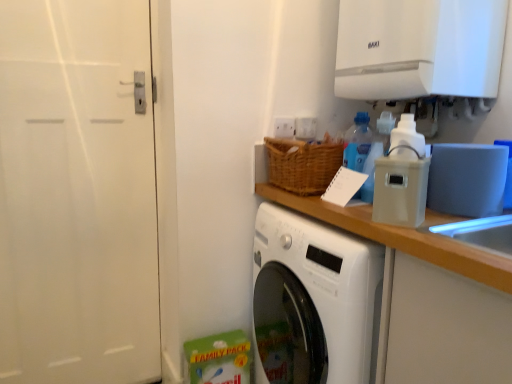
Describe the element at coordinates (400, 188) in the screenshot. The height and width of the screenshot is (384, 512). I see `white plastic container at upper right` at that location.

The height and width of the screenshot is (384, 512). I want to click on translucent plastic soap dispenser at upper right, the 2th bottle positioned from the left, so click(376, 153).

This screenshot has height=384, width=512. Identify the location of white matte door at left. (77, 194).

Locate an element on the screen. white glossy exhaust hood at upper right is located at coordinates (419, 48).

Measure the distance between white glossy exhaust hood at upper right and camera.

white glossy exhaust hood at upper right and camera are 1.20 meters apart from each other.

The width and height of the screenshot is (512, 384). In order to click on white plastic container at upper right in this screenshot , I will do `click(400, 188)`.

From the image's perspective, which one is positioned lower, white matte door at left or white plastic container at upper right?

white matte door at left, from the image's perspective.

From a real-world perspective, is white matte door at left positioned over white plastic container at upper right based on gravity?

No, from a real-world perspective, white matte door at left is not on top of white plastic container at upper right.

Considering the positions of objects white matte door at left and white plastic container at upper right in the image provided, who is more to the right, white matte door at left or white plastic container at upper right?

Positioned to the right is white plastic container at upper right.

I want to click on appliance that is on the right side of white matte door at left, so click(x=400, y=188).

Is blue translucent bottle at upper right, which appears as the 2th bottle when viewed from the right, at the back of translucent plastic soap dispenser at upper right, the 2th bottle positioned from the left?

Yes, translucent plastic soap dispenser at upper right, the 2th bottle positioned from the left, is positioned with its back facing blue translucent bottle at upper right, which appears as the 2th bottle when viewed from the right.

Which is less distant, [372,170] or [344,154]?

Point [372,170] is closer to the camera than point [344,154].

From a real-world perspective, is translucent plastic soap dispenser at upper right, placed as the 1th bottle when sorted from right to left, below blue translucent bottle at upper right, marked as the first bottle in a left-to-right arrangement?

Indeed, from a real-world perspective, translucent plastic soap dispenser at upper right, placed as the 1th bottle when sorted from right to left, is positioned beneath blue translucent bottle at upper right, marked as the first bottle in a left-to-right arrangement.

Considering the sizes of objects translucent plastic soap dispenser at upper right, the 2th bottle positioned from the left, and blue translucent bottle at upper right, marked as the first bottle in a left-to-right arrangement, in the image provided, who is shorter, translucent plastic soap dispenser at upper right, the 2th bottle positioned from the left, or blue translucent bottle at upper right, marked as the first bottle in a left-to-right arrangement,?

translucent plastic soap dispenser at upper right, the 2th bottle positioned from the left, is shorter.

Considering the positions of objects blue translucent bottle at upper right, marked as the first bottle in a left-to-right arrangement, and white glossy exhaust hood at upper right in the image provided, who is more to the left, blue translucent bottle at upper right, marked as the first bottle in a left-to-right arrangement, or white glossy exhaust hood at upper right?

blue translucent bottle at upper right, marked as the first bottle in a left-to-right arrangement, is more to the left.

Is blue translucent bottle at upper right, which appears as the 2th bottle when viewed from the right, oriented away from white glossy exhaust hood at upper right?

No, white glossy exhaust hood at upper right is not at the back of blue translucent bottle at upper right, which appears as the 2th bottle when viewed from the right.

Considering the relative sizes of blue translucent bottle at upper right, which appears as the 2th bottle when viewed from the right, and white glossy exhaust hood at upper right in the image provided, is blue translucent bottle at upper right, which appears as the 2th bottle when viewed from the right, smaller than white glossy exhaust hood at upper right?

Yes.

How much distance is there between blue translucent bottle at upper right, which appears as the 2th bottle when viewed from the right, and white glossy exhaust hood at upper right?

blue translucent bottle at upper right, which appears as the 2th bottle when viewed from the right, is 12.64 inches away from white glossy exhaust hood at upper right.

Is blue translucent bottle at upper right, which appears as the 2th bottle when viewed from the right, aimed at translucent plastic soap dispenser at upper right, placed as the 1th bottle when sorted from right to left?

Yes.

Would you say blue translucent bottle at upper right, marked as the first bottle in a left-to-right arrangement, is a long distance from translucent plastic soap dispenser at upper right, the 2th bottle positioned from the left?

No, there isn't a large distance between blue translucent bottle at upper right, marked as the first bottle in a left-to-right arrangement, and translucent plastic soap dispenser at upper right, the 2th bottle positioned from the left.

Which object is wider, blue translucent bottle at upper right, which appears as the 2th bottle when viewed from the right, or translucent plastic soap dispenser at upper right, placed as the 1th bottle when sorted from right to left?

With larger width is translucent plastic soap dispenser at upper right, placed as the 1th bottle when sorted from right to left.

Is blue translucent bottle at upper right, marked as the first bottle in a left-to-right arrangement, positioned behind translucent plastic soap dispenser at upper right, placed as the 1th bottle when sorted from right to left?

Yes.

How far apart are blue translucent bottle at upper right, marked as the first bottle in a left-to-right arrangement, and white plastic container at upper right?

The distance of blue translucent bottle at upper right, marked as the first bottle in a left-to-right arrangement, from white plastic container at upper right is 9.04 inches.

In the image, is blue translucent bottle at upper right, which appears as the 2th bottle when viewed from the right, on the left side or the right side of white plastic container at upper right?

From the image, it's evident that blue translucent bottle at upper right, which appears as the 2th bottle when viewed from the right, is to the left of white plastic container at upper right.

Does blue translucent bottle at upper right, marked as the first bottle in a left-to-right arrangement, have a lesser height compared to white plastic container at upper right?

No.

Would you consider blue translucent bottle at upper right, which appears as the 2th bottle when viewed from the right, to be distant from white plastic container at upper right?

That's not correct — blue translucent bottle at upper right, which appears as the 2th bottle when viewed from the right, is a little close to white plastic container at upper right.

Which is more distant, (407, 222) or (346, 148)?

The point (346, 148) is farther from the camera.

Identify the location of appliance that is on the right side of blue translucent bottle at upper right, marked as the first bottle in a left-to-right arrangement. Image resolution: width=512 pixels, height=384 pixels. (400, 188).

Considering the relative sizes of white plastic container at upper right and blue translucent bottle at upper right, marked as the first bottle in a left-to-right arrangement, in the image provided, is white plastic container at upper right thinner than blue translucent bottle at upper right, marked as the first bottle in a left-to-right arrangement,?

No, white plastic container at upper right is not thinner than blue translucent bottle at upper right, marked as the first bottle in a left-to-right arrangement.

Considering the sizes of objects white plastic container at upper right and blue translucent bottle at upper right, which appears as the 2th bottle when viewed from the right, in the image provided, who is shorter, white plastic container at upper right or blue translucent bottle at upper right, which appears as the 2th bottle when viewed from the right,?

Standing shorter between the two is white plastic container at upper right.

Consider the image. Is translucent plastic soap dispenser at upper right, the 2th bottle positioned from the left, closer to the viewer compared to white glossy exhaust hood at upper right?

No.

Measure the distance from translucent plastic soap dispenser at upper right, placed as the 1th bottle when sorted from right to left, to white glossy exhaust hood at upper right.

10.42 inches.

From the image's perspective, which is above, translucent plastic soap dispenser at upper right, placed as the 1th bottle when sorted from right to left, or white glossy exhaust hood at upper right?

white glossy exhaust hood at upper right, from the image's perspective.

Considering the relative sizes of translucent plastic soap dispenser at upper right, placed as the 1th bottle when sorted from right to left, and white glossy exhaust hood at upper right in the image provided, is translucent plastic soap dispenser at upper right, placed as the 1th bottle when sorted from right to left, wider than white glossy exhaust hood at upper right?

No.

Find the location of `appliance in front of the white matte door at left`. appliance in front of the white matte door at left is located at coordinates (400, 188).

Identify the location of bottle below the blue translucent bottle at upper right, which appears as the 2th bottle when viewed from the right (from the image's perspective). [x=376, y=153].

Which object lies nearer to the anchor point blue translucent bottle at upper right, which appears as the 2th bottle when viewed from the right, white matte door at left or white glossy exhaust hood at upper right?

Among the two, white glossy exhaust hood at upper right is located nearer to blue translucent bottle at upper right, which appears as the 2th bottle when viewed from the right.

Based on their spatial positions, is translucent plastic soap dispenser at upper right, the 2th bottle positioned from the left, or white glossy exhaust hood at upper right closer to white matte door at left?

white glossy exhaust hood at upper right lies closer to white matte door at left than the other object.

From the image, which object appears to be nearer to translucent plastic soap dispenser at upper right, the 2th bottle positioned from the left, blue translucent bottle at upper right, marked as the first bottle in a left-to-right arrangement, or white plastic container at upper right?

blue translucent bottle at upper right, marked as the first bottle in a left-to-right arrangement, lies closer to translucent plastic soap dispenser at upper right, the 2th bottle positioned from the left, than the other object.

Which object lies further to the anchor point white plastic container at upper right, white glossy exhaust hood at upper right or translucent plastic soap dispenser at upper right, placed as the 1th bottle when sorted from right to left?

Among the two, white glossy exhaust hood at upper right is located further to white plastic container at upper right.

Looking at the image, which one is located closer to translucent plastic soap dispenser at upper right, placed as the 1th bottle when sorted from right to left, white glossy exhaust hood at upper right or blue translucent bottle at upper right, marked as the first bottle in a left-to-right arrangement?

blue translucent bottle at upper right, marked as the first bottle in a left-to-right arrangement.

Based on the photo, when comparing their distances from white plastic container at upper right, does translucent plastic soap dispenser at upper right, placed as the 1th bottle when sorted from right to left, or white matte door at left seem further?

white matte door at left.

From the image, which object appears to be farther from translucent plastic soap dispenser at upper right, placed as the 1th bottle when sorted from right to left, white matte door at left or white glossy exhaust hood at upper right?

The object further to translucent plastic soap dispenser at upper right, placed as the 1th bottle when sorted from right to left, is white matte door at left.

Considering their positions, is white matte door at left positioned further to white glossy exhaust hood at upper right than white plastic container at upper right?

white matte door at left lies further to white glossy exhaust hood at upper right than the other object.

Where is `bottle located between white plastic container at upper right and blue translucent bottle at upper right, which appears as the 2th bottle when viewed from the right, in the depth direction`? The width and height of the screenshot is (512, 384). bottle located between white plastic container at upper right and blue translucent bottle at upper right, which appears as the 2th bottle when viewed from the right, in the depth direction is located at coordinates (376, 153).

Image resolution: width=512 pixels, height=384 pixels. What are the coordinates of `bottle between white glossy exhaust hood at upper right and translucent plastic soap dispenser at upper right, the 2th bottle positioned from the left, vertically` in the screenshot? It's located at (357, 143).

Identify the location of appliance between white matte door at left and translucent plastic soap dispenser at upper right, placed as the 1th bottle when sorted from right to left, from left to right. click(400, 188).

The image size is (512, 384). What are the coordinates of `appliance situated between white matte door at left and white glossy exhaust hood at upper right from left to right` in the screenshot? It's located at (400, 188).